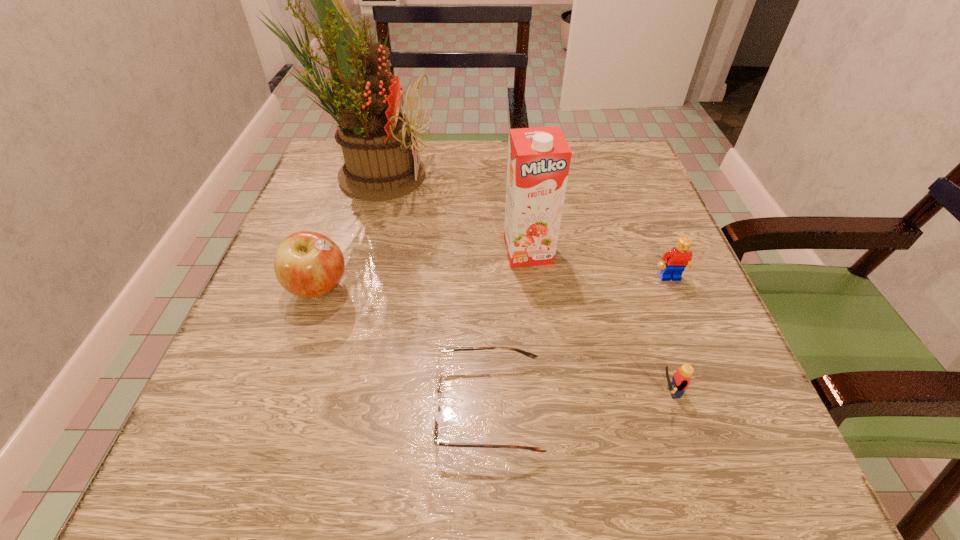
Choose which object is the second nearest neighbor to the apple. Please provide its 2D coordinates. Your answer should be formatted as a tuple, i.e. [(x, y)], where the tuple contains the x and y coordinates of a point satisfying the conditions above.

[(436, 410)]

This screenshot has height=540, width=960. Identify the location of free space in the image that satisfies the following two spatial constraints: 1. on the front-facing side of the right Lego; 2. on the front-facing side of the shortest object. (724, 408).

Image resolution: width=960 pixels, height=540 pixels. What are the coordinates of `free point that satisfies the following two spatial constraints: 1. in front of the carton with the fan visible; 2. on the right side of the tallest object` in the screenshot? It's located at (349, 251).

I want to click on vacant space that satisfies the following two spatial constraints: 1. on the front-facing side of the right Lego; 2. on the front-facing side of the nearer Lego, so click(717, 392).

The width and height of the screenshot is (960, 540). I want to click on vacant area in the image that satisfies the following two spatial constraints: 1. on the front-facing side of the right Lego; 2. on the front-facing side of the left Lego, so click(717, 392).

Identify the location of vacant space that satisfies the following two spatial constraints: 1. on the front-facing side of the right Lego; 2. on the front-facing side of the shortest object. The image size is (960, 540). (724, 408).